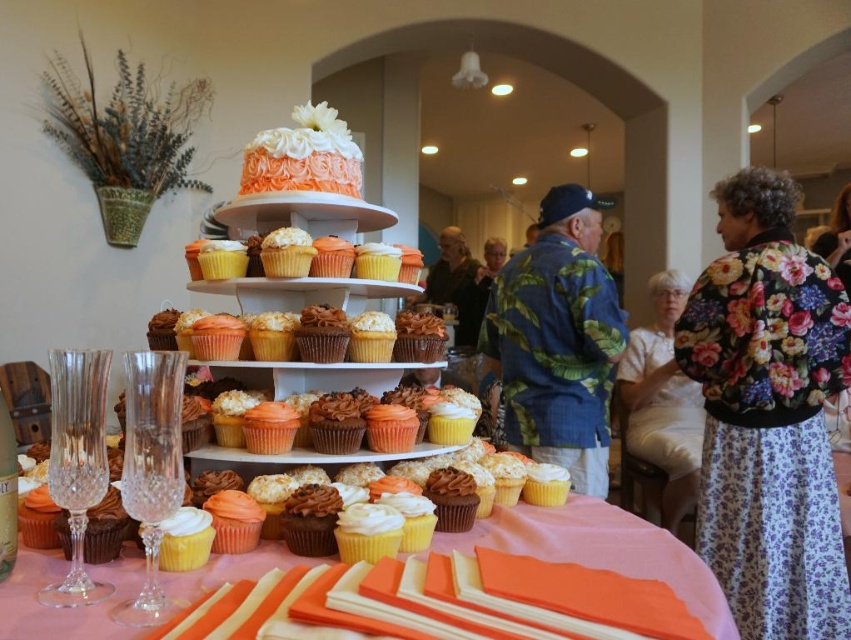
You are standing in front of the dessert display and want to place a new cupcake. You have two options for placement based on coordinates given in the image. The first option is at point (x=540, y=266) and the second is at point (x=666, y=525). Which point is closer to you?

Point (x=540, y=266) is closer to the viewer than point (x=666, y=525), so you should choose the first option.

You are planning to wear either the floral fabric shirt at center or the white floral dress at lower right to a party. If you want to choose the wider garment, which one should you pick?

The floral fabric shirt at center might be wider than the white floral dress at lower right, so you should pick the floral fabric shirt at center if you want a wider garment.